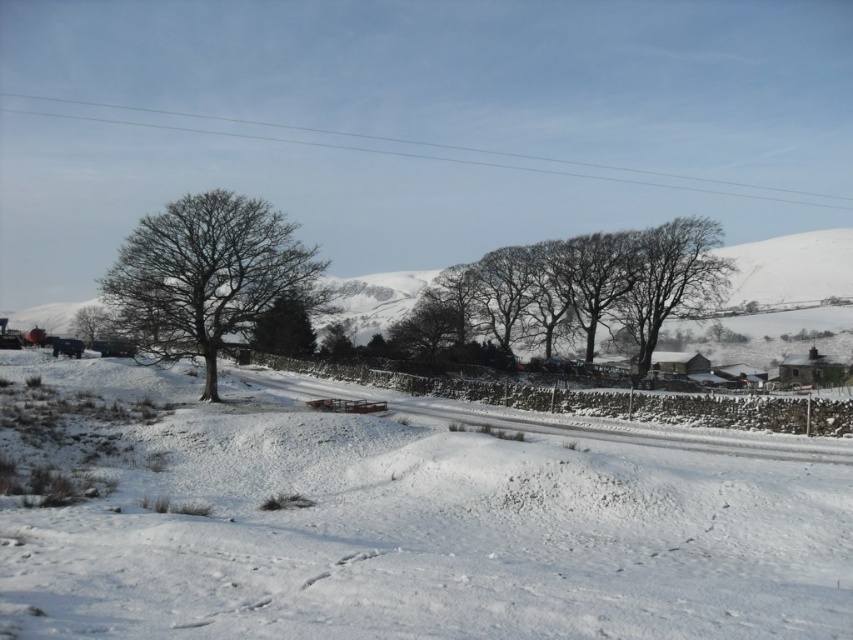
You are an observer standing in the winter landscape. You notice the white powdery snow at center and the green leafy tree at center. Which one has a greater height?

The green leafy tree at center is taller than the white powdery snow at center.

Where is the bare branches at center located in the image?

The bare branches at center is located at point (589, 284) in the image.

You are a bird flying at an altitude of 500 feet. You spot the bare branches at center from above. Can you land on them?

The distance between you and the bare branches at center is 583.31 feet, which is greater than your current altitude of 500 feet. Therefore, you cannot land on the bare branches at center.